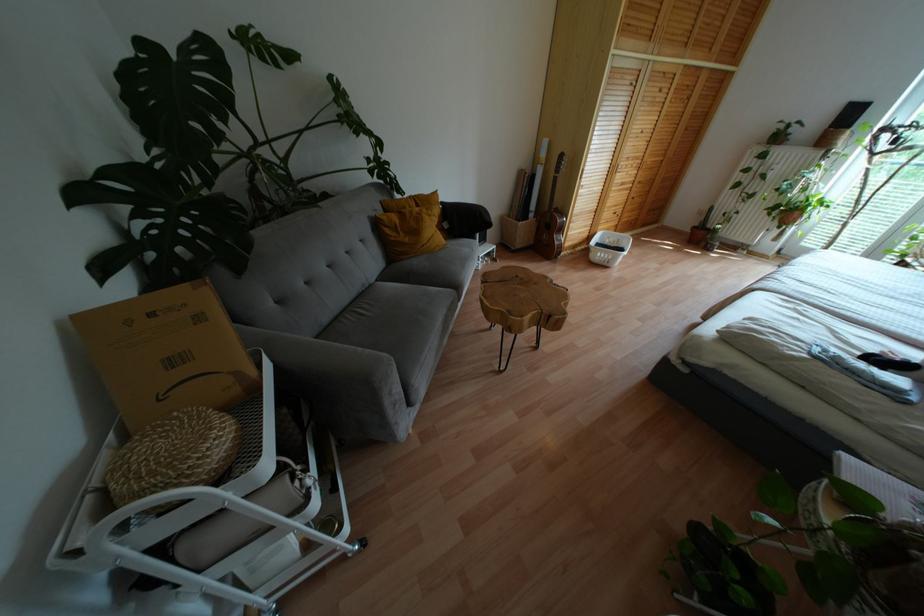
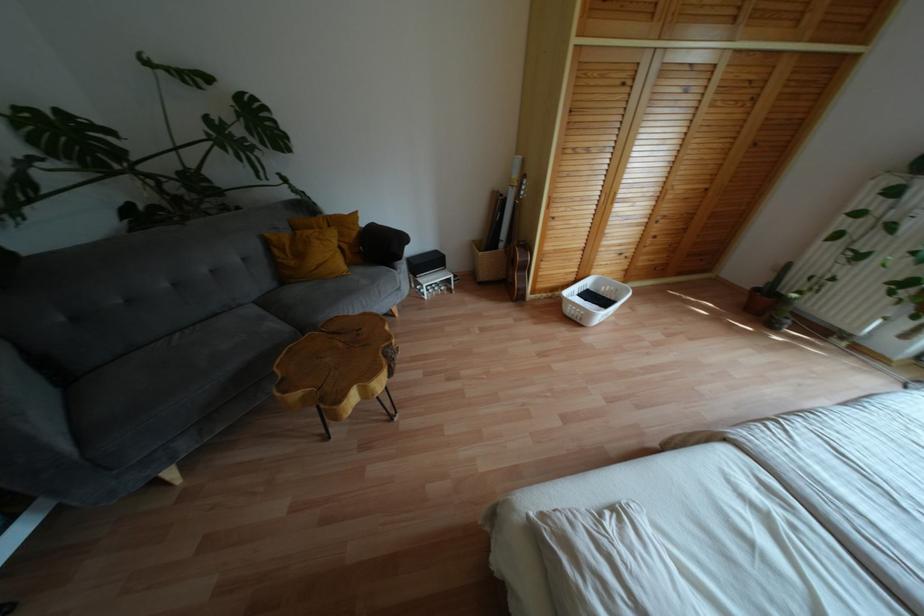
The point at [443,240] is marked in the first image. Where is the corresponding point in the second image?

(343, 267)